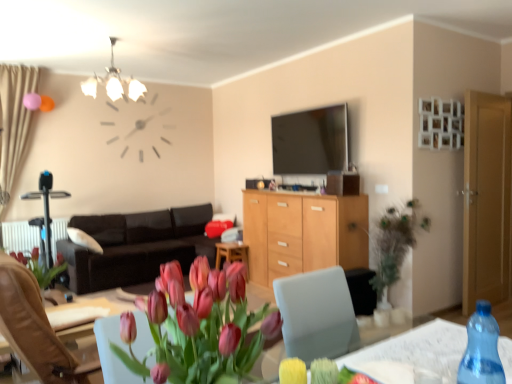
Describe the element at coordinates (20, 236) in the screenshot. Image resolution: width=512 pixels, height=384 pixels. I see `white plastic radiator at lower left` at that location.

Where is `transparent plastic bottle at lower right`? transparent plastic bottle at lower right is located at coordinates pyautogui.click(x=419, y=349).

Identify the location of light brown wooden door at right. (486, 198).

The width and height of the screenshot is (512, 384). Describe the element at coordinates (393, 247) in the screenshot. I see `green leafy plant at right` at that location.

Identify the location of wooden desk at center. This screenshot has width=512, height=384. (232, 254).

How distant is wooden cabinet at center from matte pink tulips at center?

The distance of wooden cabinet at center from matte pink tulips at center is 3.11 meters.

Are wooden cabinet at center and matte pink tulips at center located far from each other?

wooden cabinet at center is far away from matte pink tulips at center.

Considering their positions, is wooden cabinet at center located in front of or behind matte pink tulips at center?

In the image, wooden cabinet at center appears behind matte pink tulips at center.

Based on the photo, from a real-world perspective, is wooden cabinet at center on matte pink tulips at center?

No, from a real-world perspective, wooden cabinet at center is not above matte pink tulips at center.

From the image's perspective, between green leafy plant at right and beige fabric curtain at left, which one is located above?

beige fabric curtain at left, from the image's perspective.

Does green leafy plant at right turn towards beige fabric curtain at left?

No.

Does green leafy plant at right have a greater width compared to beige fabric curtain at left?

Indeed, green leafy plant at right has a greater width compared to beige fabric curtain at left.

Consider the image. In terms of width, does green leafy plant at right look wider or thinner when compared to dark brown leather couch at center?

green leafy plant at right is thinner than dark brown leather couch at center.

Which is less distant, (x=391, y=253) or (x=192, y=209)?

The point (x=391, y=253) is more forward.

The width and height of the screenshot is (512, 384). What are the coordinates of `studio couch below the green leafy plant at right (from the image's perspective)` in the screenshot? It's located at (136, 246).

Can you tell me how much matte glass chandelier at upper center and blue translucent bottle at lower right differ in facing direction?

There is a 178-degree angle between the facing directions of matte glass chandelier at upper center and blue translucent bottle at lower right.

Can you confirm if matte glass chandelier at upper center is bigger than blue translucent bottle at lower right?

Yes, matte glass chandelier at upper center is bigger than blue translucent bottle at lower right.

Considering the sizes of objects matte glass chandelier at upper center and blue translucent bottle at lower right in the image provided, who is shorter, matte glass chandelier at upper center or blue translucent bottle at lower right?

Standing shorter between the two is blue translucent bottle at lower right.

Considering the sizes of objects matte glass chandelier at upper center and blue translucent bottle at lower right in the image provided, who is thinner, matte glass chandelier at upper center or blue translucent bottle at lower right?

Thinner between the two is blue translucent bottle at lower right.

Image resolution: width=512 pixels, height=384 pixels. Identify the location of radiator above the wooden desk at center (from the image's perspective). (20, 236).

Is white plastic radiator at lower left in front of or behind wooden desk at center in the image?

In the image, white plastic radiator at lower left appears behind wooden desk at center.

Considering the relative positions of white plastic radiator at lower left and wooden desk at center in the image provided, is white plastic radiator at lower left to the left of wooden desk at center from the viewer's perspective?

Yes.

Is wooden cabinet at center shorter than beige fabric curtain at left?

Yes, wooden cabinet at center is shorter than beige fabric curtain at left.

Can you confirm if wooden cabinet at center is positioned to the left of beige fabric curtain at left?

No, wooden cabinet at center is not to the left of beige fabric curtain at left.

Identify the location of cabinetry lying on the right of beige fabric curtain at left. The width and height of the screenshot is (512, 384). coord(303,233).

Which is less distant, (x=318, y=203) or (x=29, y=68)?

Point (x=318, y=203).

Which of these two, wooden cabinet at center or matte glass chandelier at upper center, is wider?

matte glass chandelier at upper center.

From a real-world perspective, between wooden cabinet at center and matte glass chandelier at upper center, who is vertically higher?

From a 3D spatial view, matte glass chandelier at upper center is above.

Looking at this image, from the image's perspective, which one is positioned lower, wooden cabinet at center or matte glass chandelier at upper center?

From the image's view, wooden cabinet at center is below.

Identify the location of houseplant in front of the wooden cabinet at center. (198, 327).

In the image, there is a beige fabric curtain at left. At what (x,y) coordinates should I click in order to perform the action: click on floral arrangement below it (from the image's perspective). Please return your answer as a coordinate pair (x, y). This screenshot has height=384, width=512. Looking at the image, I should click on (393, 247).

From the picture: Estimate the real-world distances between objects in this image. Which object is further from dark brown leather couch at center, wooden cabinet at center or matte glass chandelier at upper center?

Based on the image, matte glass chandelier at upper center appears to be further to dark brown leather couch at center.

When comparing their distances from blue translucent bottle at lower right, does white plastic radiator at lower left or dark brown leather couch at center seem closer?

dark brown leather couch at center is closer to blue translucent bottle at lower right.

Estimate the real-world distances between objects in this image. Which object is closer to blue translucent bottle at lower right, matte glass chandelier at upper center or beige fabric curtain at left?

Among the two, beige fabric curtain at left is located nearer to blue translucent bottle at lower right.

Considering their positions, is matte glass chandelier at upper center positioned closer to white plastic radiator at lower left than light brown wooden door at right?

Based on the image, matte glass chandelier at upper center appears to be nearer to white plastic radiator at lower left.

Based on their spatial positions, is wooden cabinet at center or light brown wooden door at right closer to dark brown leather couch at center?

wooden cabinet at center.

Estimate the real-world distances between objects in this image. Which object is closer to dark brown leather couch at center, transparent plastic bottle at lower right or blue translucent bottle at lower right?

transparent plastic bottle at lower right.

Based on their spatial positions, is dark brown leather couch at center or blue translucent bottle at lower right closer to transparent plastic bottle at lower right?

blue translucent bottle at lower right is positioned closer to the anchor transparent plastic bottle at lower right.

Estimate the real-world distances between objects in this image. Which object is closer to transparent plastic bottle at lower right, beige fabric curtain at left or matte pink tulips at center?

matte pink tulips at center lies closer to transparent plastic bottle at lower right than the other object.

You are a GUI agent. You are given a task and a screenshot of the screen. Output one action in this format:
    pyautogui.click(x=<x>, y=<y>)
    Task: Click on the studio couch located between beige fabric curtain at left and green leafy plant at right in the left-right direction
    Image resolution: width=512 pixels, height=384 pixels.
    Given the screenshot: What is the action you would take?
    pyautogui.click(x=136, y=246)

Where is `floral arrangement between blue translucent bottle at lower right and dark brown leather couch at center in the front-back direction`? This screenshot has height=384, width=512. floral arrangement between blue translucent bottle at lower right and dark brown leather couch at center in the front-back direction is located at coordinates point(393,247).

Find the location of `round table between white plastic radiator at lower left and light brown wooden door at right in the horizontal direction`. round table between white plastic radiator at lower left and light brown wooden door at right in the horizontal direction is located at coordinates (419, 349).

Find the location of a particular element. round table located between blue translucent bottle at lower right and white plastic radiator at lower left in the depth direction is located at coordinates (419, 349).